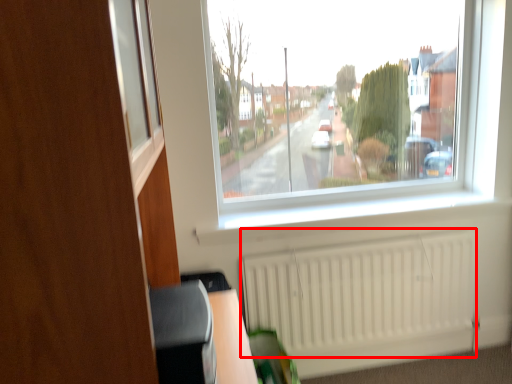
Question: Where is radiator (annotated by the red box) located in relation to dresser in the image?

Choices:
 (A) left
 (B) right

Answer: (B)